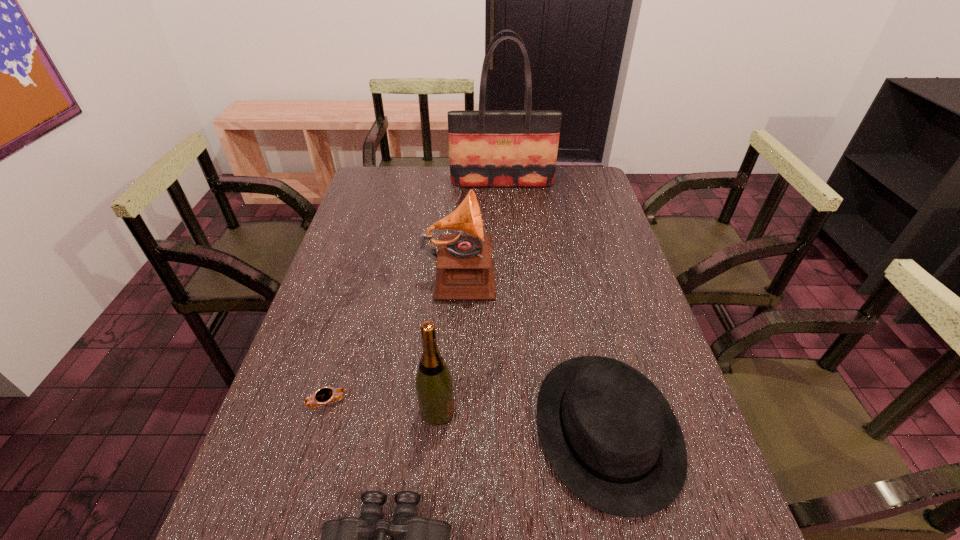
Identify the location of empty space that is in between the wine bottle and the shortest object. The height and width of the screenshot is (540, 960). (382, 407).

The width and height of the screenshot is (960, 540). I want to click on blank region between the leftmost object and the phonograph record, so click(x=394, y=338).

Find the location of a particular element. empty location between the third shortest object and the phonograph record is located at coordinates (534, 350).

Select which object is the fifth closest to the wine bottle. Please provide its 2D coordinates. Your answer should be formatted as a tuple, i.e. [(x, y)], where the tuple contains the x and y coordinates of a point satisfying the conditions above.

[(486, 148)]

Locate which object ranks in proximity to the second shortest object. Please provide its 2D coordinates. Your answer should be formatted as a tuple, i.e. [(x, y)], where the tuple contains the x and y coordinates of a point satisfying the conditions above.

[(434, 385)]

Locate an element on the screen. This screenshot has width=960, height=540. vacant position in the image that satisfies the following two spatial constraints: 1. on the horn of the fifth nearest object; 2. on the front side of the watch is located at coordinates (453, 403).

Locate an element on the screen. This screenshot has width=960, height=540. vacant area in the image that satisfies the following two spatial constraints: 1. on the horn of the phonograph record; 2. on the back side of the fedora is located at coordinates (452, 429).

Find the location of `free point that satisfies the following two spatial constraints: 1. on the back side of the third shortest object; 2. on the horn of the phonograph record`. free point that satisfies the following two spatial constraints: 1. on the back side of the third shortest object; 2. on the horn of the phonograph record is located at coordinates (571, 273).

Locate an element on the screen. Image resolution: width=960 pixels, height=540 pixels. vacant space that satisfies the following two spatial constraints: 1. on the horn of the fifth nearest object; 2. on the front side of the shortest object is located at coordinates (453, 403).